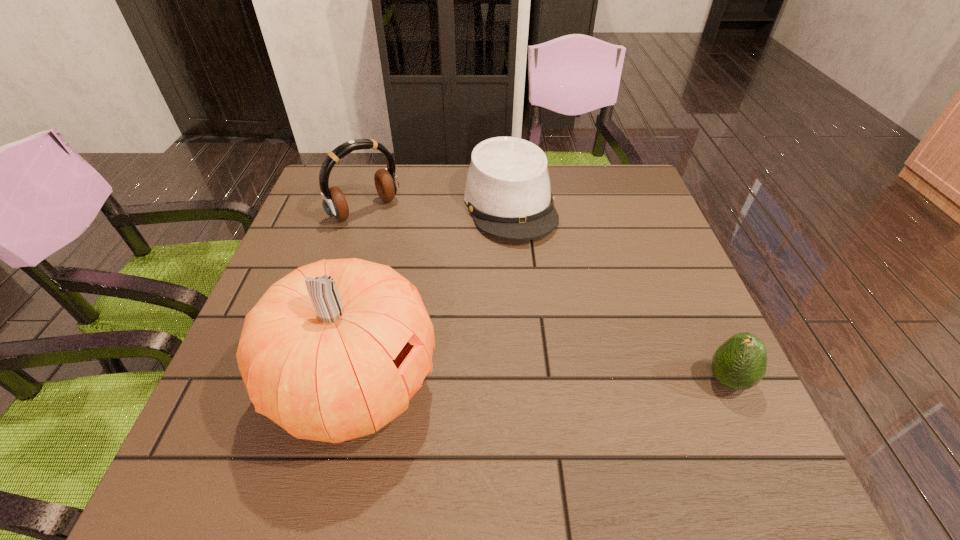
Where is `object that is at the near left corner`? object that is at the near left corner is located at coordinates (333, 351).

Locate an element on the screen. object positioned at the near right corner is located at coordinates (740, 363).

The height and width of the screenshot is (540, 960). What are the coordinates of `vacant space at the far edge of the desktop` in the screenshot? It's located at (563, 179).

The width and height of the screenshot is (960, 540). In order to click on free point at the near edge in this screenshot , I will do `click(564, 396)`.

Identify the location of vacant space at the left edge of the desktop. Image resolution: width=960 pixels, height=540 pixels. (292, 256).

Where is `vacant space at the right edge`? vacant space at the right edge is located at coordinates (670, 296).

I want to click on vacant space at the far left corner of the desktop, so click(357, 208).

The image size is (960, 540). In the image, there is a desktop. Identify the location of vacant space at the near left corner. (209, 419).

You are a GUI agent. You are given a task and a screenshot of the screen. Output one action in this format:
    pyautogui.click(x=<x>, y=<y>)
    Task: Click on the blank area at the far right corner
    The height and width of the screenshot is (540, 960).
    Given the screenshot: What is the action you would take?
    pyautogui.click(x=638, y=200)

At what (x,y) coordinates should I click in order to perform the action: click on free point between the pumpkin and the avocado. Please return your answer as a coordinate pair (x, y). This screenshot has height=540, width=960. Looking at the image, I should click on (541, 383).